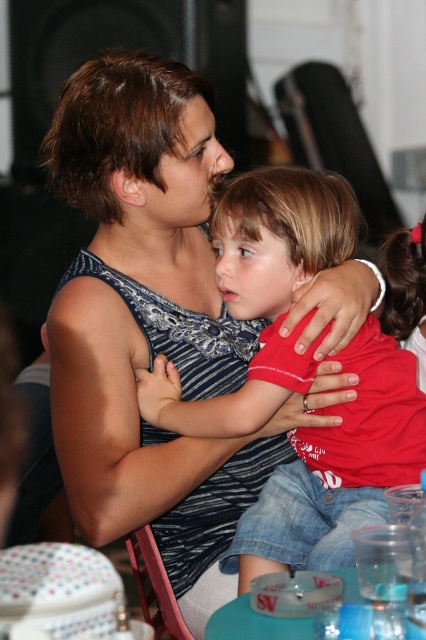
Which is in front, point (244, 308) or point (411, 282)?

Point (244, 308) is more forward.

Can you confirm if red matte shirt at center is smaller than smooth red hair at center?

Incorrect, red matte shirt at center is not smaller in size than smooth red hair at center.

In order to click on red matte shirt at center in this screenshot , I will do `click(259, 292)`.

Is smooth red hair at center to the right of wooden chair at lower center from the viewer's perspective?

Correct, you'll find smooth red hair at center to the right of wooden chair at lower center.

This screenshot has height=640, width=426. I want to click on smooth red hair at center, so click(x=406, y=291).

Which is in front, point (417, 340) or point (167, 621)?

Point (167, 621)

The height and width of the screenshot is (640, 426). I want to click on smooth red hair at center, so click(406, 291).

Looking at this image, does red matte shirt at center appear over wooden chair at lower center?

Correct, red matte shirt at center is located above wooden chair at lower center.

Can you confirm if red matte shirt at center is thinner than wooden chair at lower center?

Incorrect, red matte shirt at center's width is not less than wooden chair at lower center's.

Between point (249, 518) and point (138, 595), which one is positioned in front?

Point (249, 518)

Identify the location of red matte shirt at center. Image resolution: width=426 pixels, height=640 pixels. (259, 292).